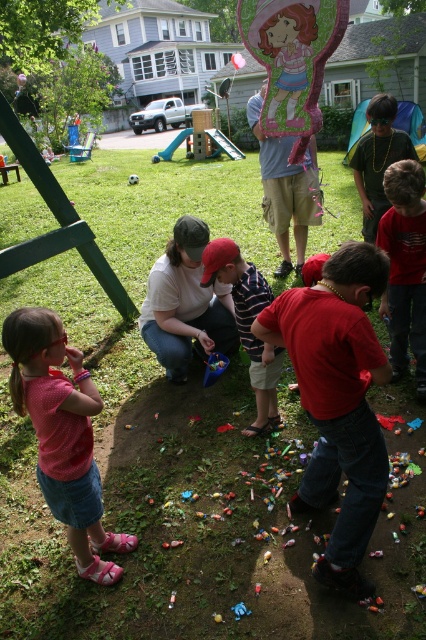
Does pink fabric dress at lower left appear over matte white shirt at center?

Actually, pink fabric dress at lower left is below matte white shirt at center.

The width and height of the screenshot is (426, 640). What do you see at coordinates (63, 435) in the screenshot?
I see `pink fabric dress at lower left` at bounding box center [63, 435].

Is point (66, 440) farther from camera compared to point (189, 275)?

No, it is in front of (189, 275).

This screenshot has width=426, height=640. I want to click on pink fabric dress at lower left, so click(x=63, y=435).

Who is taller, matte white shirt at center or green matte pinata at center?

Standing taller between the two is matte white shirt at center.

Is point (160, 296) positioned behind point (134, 180)?

No, (160, 296) is in front of (134, 180).

Identify the location of matte white shirt at center. The width and height of the screenshot is (426, 640). (186, 304).

Is pink fabric dress at lower left bigger than striped cotton shirt at center?

Incorrect, pink fabric dress at lower left is not larger than striped cotton shirt at center.

Between pink fabric dress at lower left and striped cotton shirt at center, which one has less height?

striped cotton shirt at center

Is point (89, 378) positioned in front of point (276, 420)?

Yes, point (89, 378) is closer to viewer.

Identify the location of pink fabric dress at lower left. (63, 435).